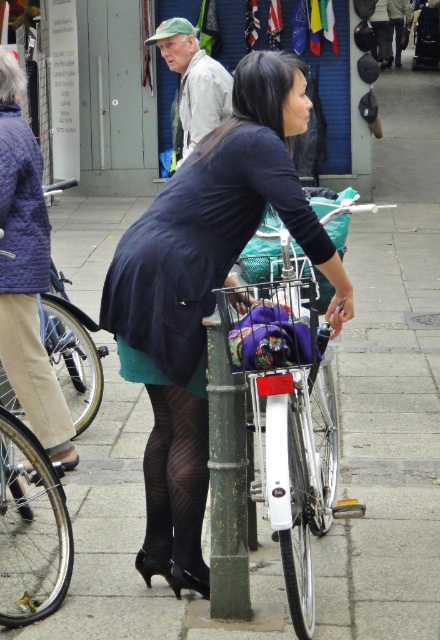
Question: Among these objects, which one is farthest from the camera?

Choices:
 (A) matte black bicycle at center
 (B) white matte bicycle at center
 (C) light beige fabric pants at lower left
 (D) teal matte dress at center

Answer: (A)

Question: Is teal matte dress at center smaller than light beige fabric pants at lower left?

Choices:
 (A) no
 (B) yes

Answer: (A)

Question: Which of the following is the farthest from the observer?

Choices:
 (A) (183, 317)
 (B) (260, 332)
 (C) (58, 442)
 (D) (245, 477)

Answer: (C)

Question: In this image, where is matte black bicycle at center located relative to white matte bicycle at center?

Choices:
 (A) left
 (B) right

Answer: (A)

Question: Does matte black dress at center lie behind teal matte dress at center?

Choices:
 (A) yes
 (B) no

Answer: (A)

Question: Considering the real-world distances, which object is closest to the green metallic pole at center?

Choices:
 (A) black mesh tights at lower center
 (B) matte black dress at center
 (C) light beige fabric pants at lower left

Answer: (A)